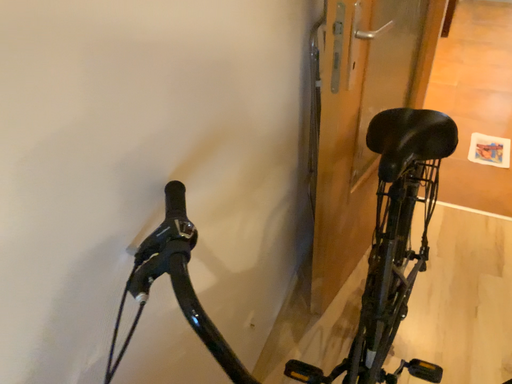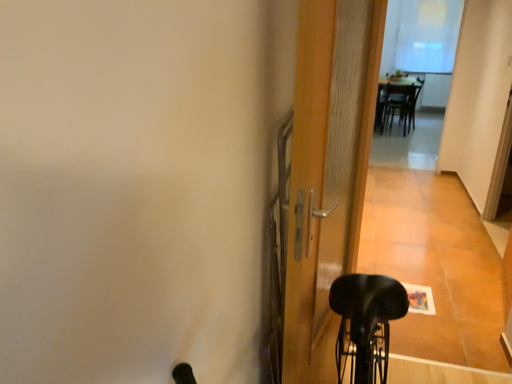
Question: Which way did the camera rotate in the video?

Choices:
 (A) rotated left
 (B) rotated right

Answer: (B)